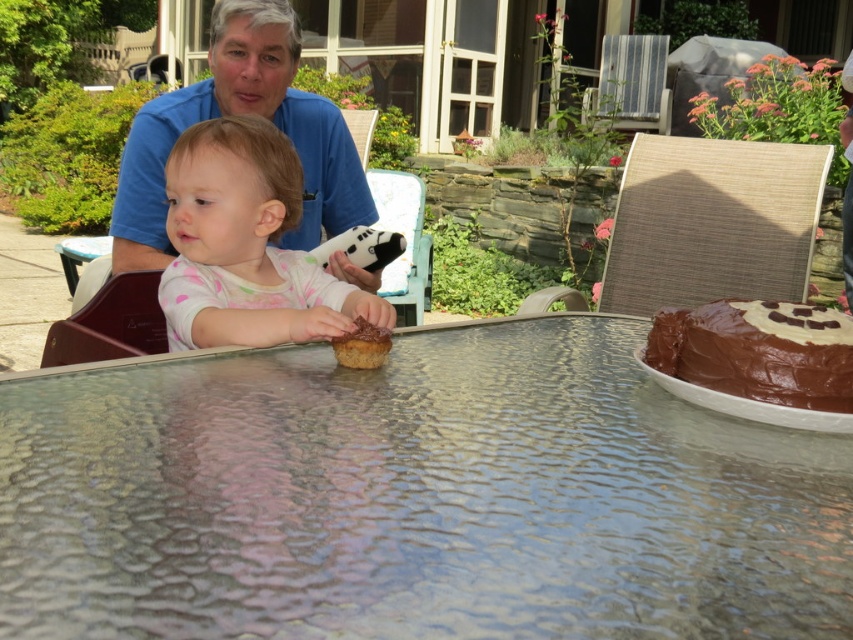
You are a photographer setting up for a birthday party. You need to place a cake on the transparent textured glass at center so that it doesn not block the view of the white dotted fabric at center. Can you do this?

The transparent textured glass at center is not as tall as white dotted fabric at center, so placing the cake on the transparent textured glass at center will not block the view of the white dotted fabric at center.

You are a photographer setting up a shot of the scene. You want to ensure the transparent textured glass at center and the white dotted fabric at center are both visible. Which object should you focus on first to make sure both are in focus?

The transparent textured glass at center is in front of the white dotted fabric at center, so you should focus on the transparent textured glass at center first to ensure both are in focus.

You are planning to place a small cupcake between the white dotted fabric at center and the chocolate cake at center on the table. Based on their widths, can you determine which side of the cupcake should be closer to the wider object?

The white dotted fabric at center might be wider than chocolate cake at center, so the cupcake should be placed closer to the white dotted fabric at center to accommodate its width.